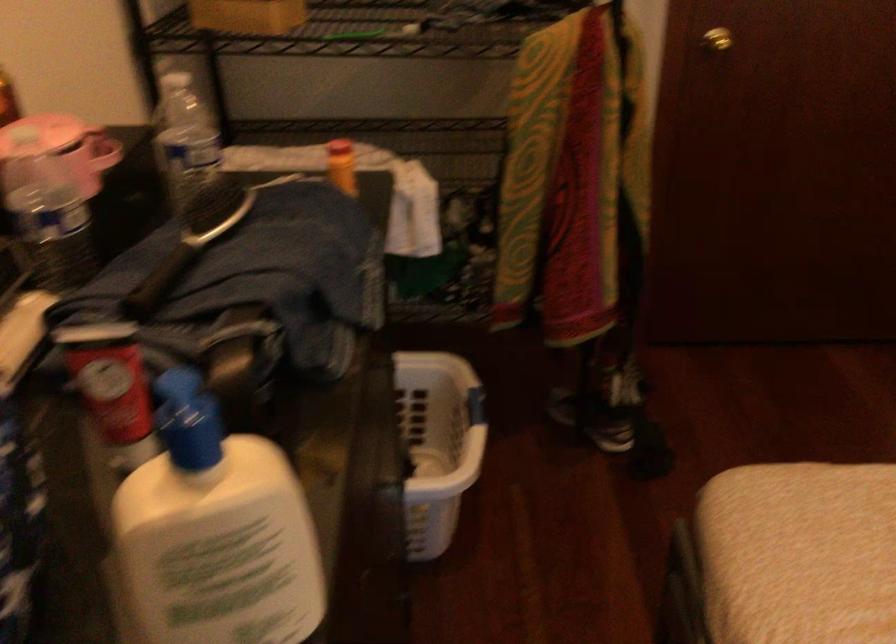
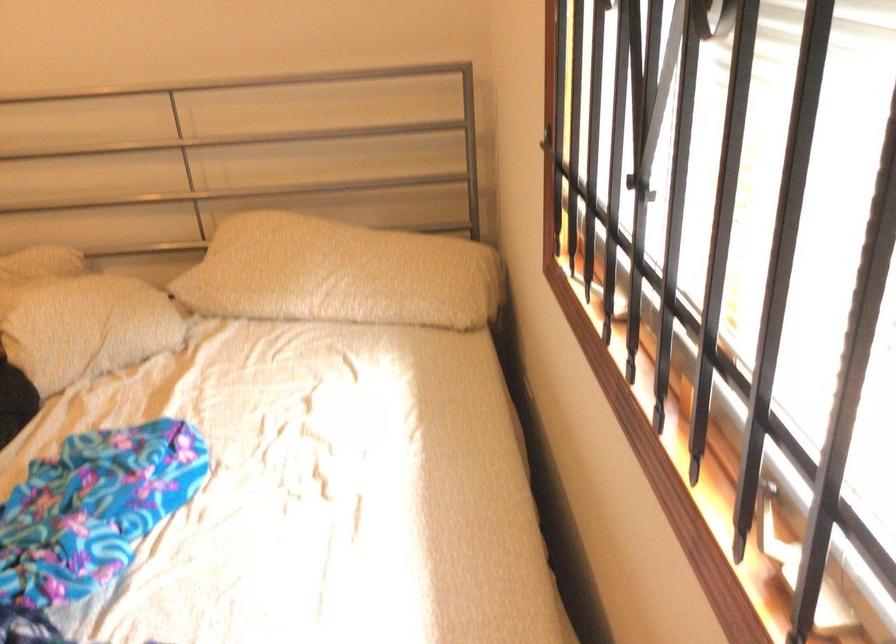
The images are taken continuously from a first-person perspective. In which direction is your viewpoint rotating?

The camera's rotation is toward right-down.